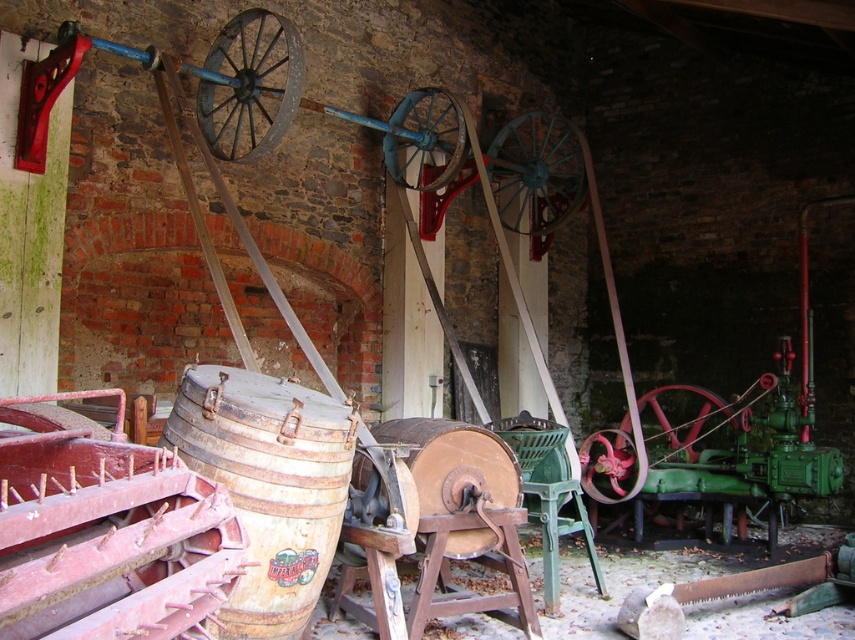
Question: Based on their relative distances, which object is farther from the metallic red wheel at center?

Choices:
 (A) wooden barrel at center
 (B) green painted metal wagon wheel at center right

Answer: (A)

Question: Does rusty metal wheel at upper left have a lesser width compared to green painted metal wagon wheel at center right?

Choices:
 (A) no
 (B) yes

Answer: (B)

Question: Considering the real-world distances, which object is closest to the metallic red wheel at center?

Choices:
 (A) rusty wooden barrel at center-left
 (B) rusty metal wheel at upper left

Answer: (A)

Question: Can you confirm if rustic wooden wheel at center is positioned below metallic red wheel at center?

Choices:
 (A) no
 (B) yes

Answer: (A)

Question: Which object is closer to the camera taking this photo?

Choices:
 (A) green painted metal wagon wheel at center right
 (B) metallic red wheel at center

Answer: (B)

Question: Is rusty metal wheel at upper left above rustic wooden wheel at center?

Choices:
 (A) yes
 (B) no

Answer: (A)